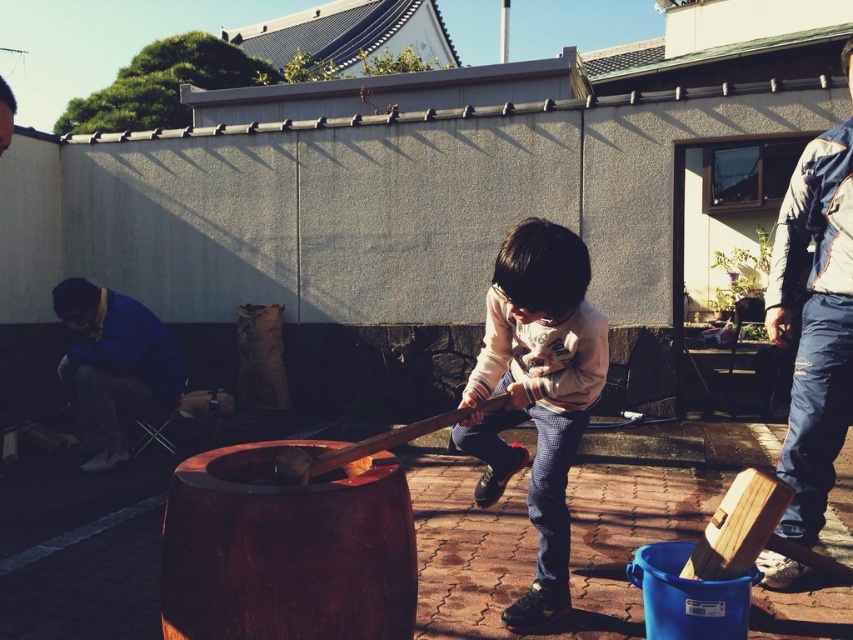
You are a delivery person who needs to place a 3.5 meter long package between the white fleece sweater at center and the blue fabric at left. Can you fit the package between them without bending it?

The distance between the white fleece sweater at center and the blue fabric at left is 3.26 meters. Since the package is 3.5 meters long, it cannot fit between them without bending it.

You are a photographer trying to capture the scene of the dark brown wooden barrel at center and the white fleece sweater at center. Which object should you focus on first if you want to ensure both are in frame without moving the camera?

You should focus on the dark brown wooden barrel at center first because it occupies less space than the white fleece sweater at center, so it will be easier to fit into the frame while still capturing the larger sweater.